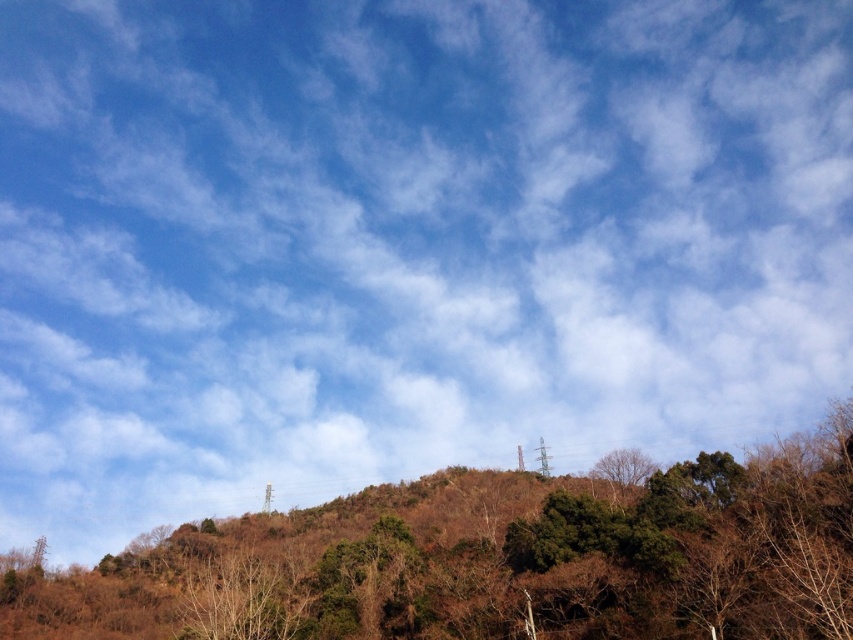
You are an environmental scientist analyzing the image. You notice a point labeled as point (489, 560). Based on the scene description, what is the most likely object at this coordinate?

The point (489, 560) corresponds to brown dry wood at center.